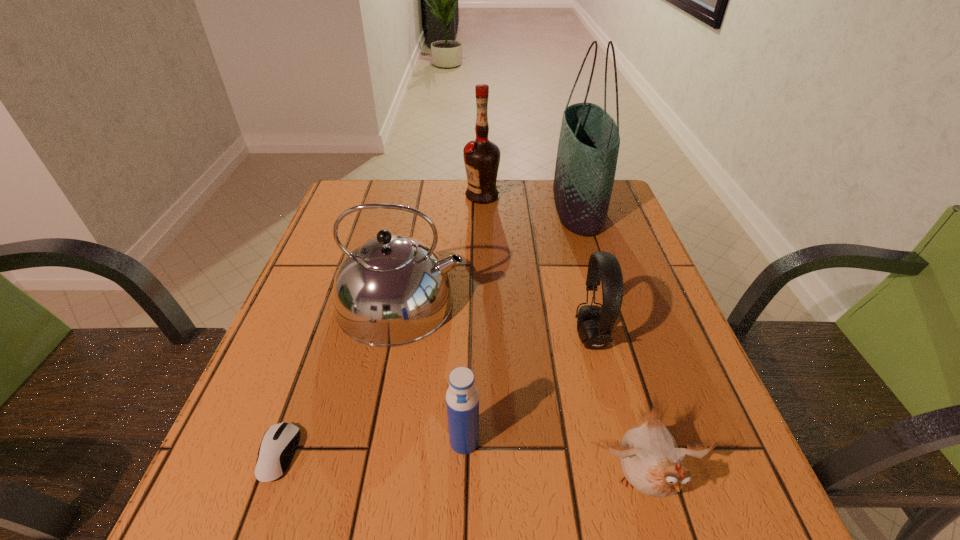
This screenshot has height=540, width=960. I want to click on mouse that is at the near edge, so click(280, 441).

I want to click on kettle located at the left edge, so click(x=392, y=290).

Where is `mouse that is positioned at the left edge`? mouse that is positioned at the left edge is located at coordinates (280, 441).

I want to click on tote bag that is at the right edge, so click(589, 140).

Locate an element on the screen. headset situated at the right edge is located at coordinates (594, 323).

The height and width of the screenshot is (540, 960). I want to click on bird that is at the right edge, so click(x=652, y=463).

Where is `object that is at the near left corner`? This screenshot has height=540, width=960. object that is at the near left corner is located at coordinates (280, 441).

What are the coordinates of `object that is at the far right corner` in the screenshot? It's located at (589, 140).

In order to click on object situated at the near right corner in this screenshot , I will do `click(652, 463)`.

Locate an element on the screen. free space at the far edge is located at coordinates (548, 184).